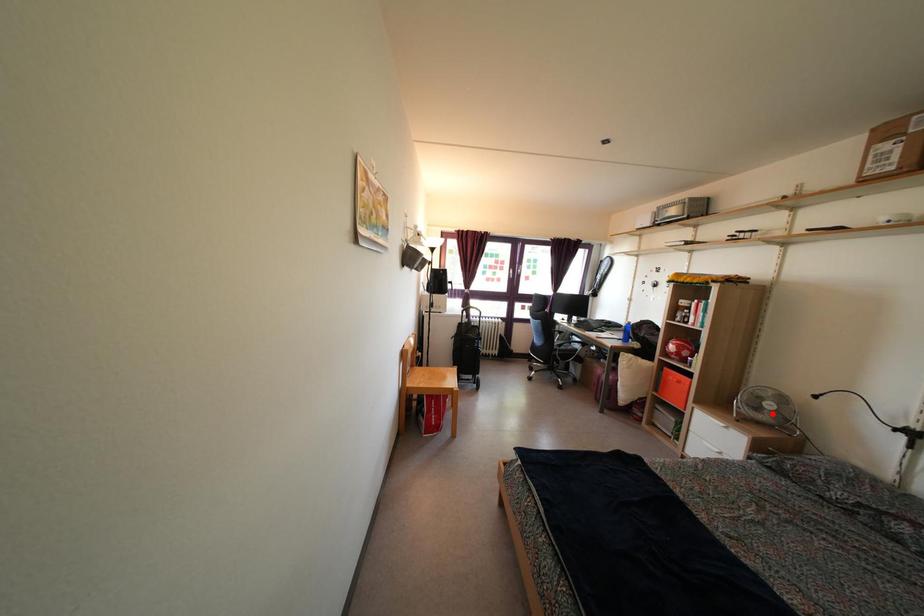
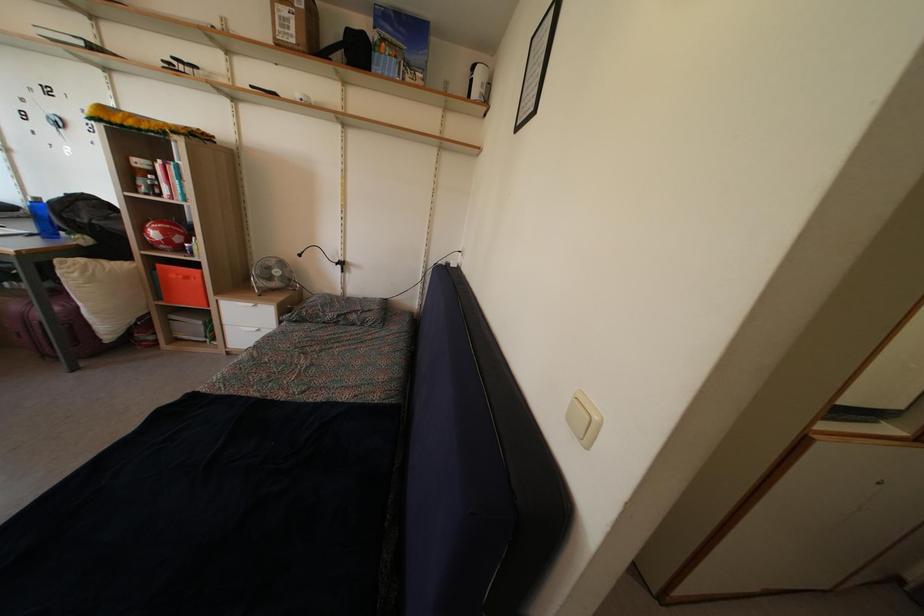
Question: I am providing you with two images of the same scene from different viewpoints. Image1 has a red point marked. In image2, the corresponding 3D location appears at what relative position? Reply with the corresponding letter.

Choices:
 (A) Closer
 (B) Farther

Answer: (A)